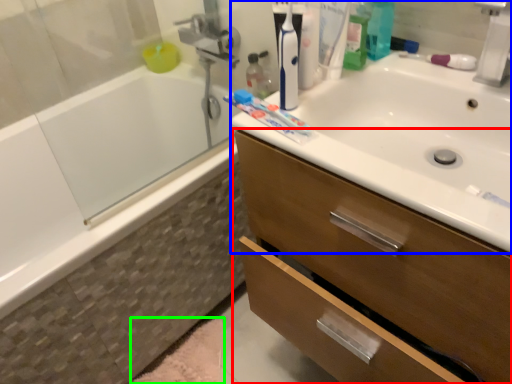
Question: Estimate the real-world distances between objects in this image. Which object is closer to bathroom cabinet (highlighted by a red box), sink (highlighted by a blue box) or bath mat (highlighted by a green box)?

Choices:
 (A) sink
 (B) bath mat

Answer: (A)